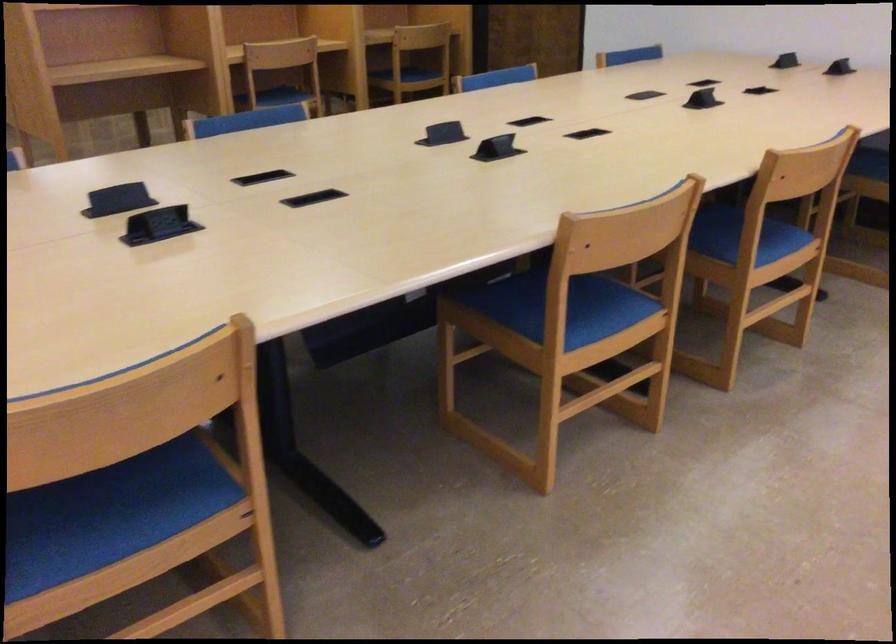
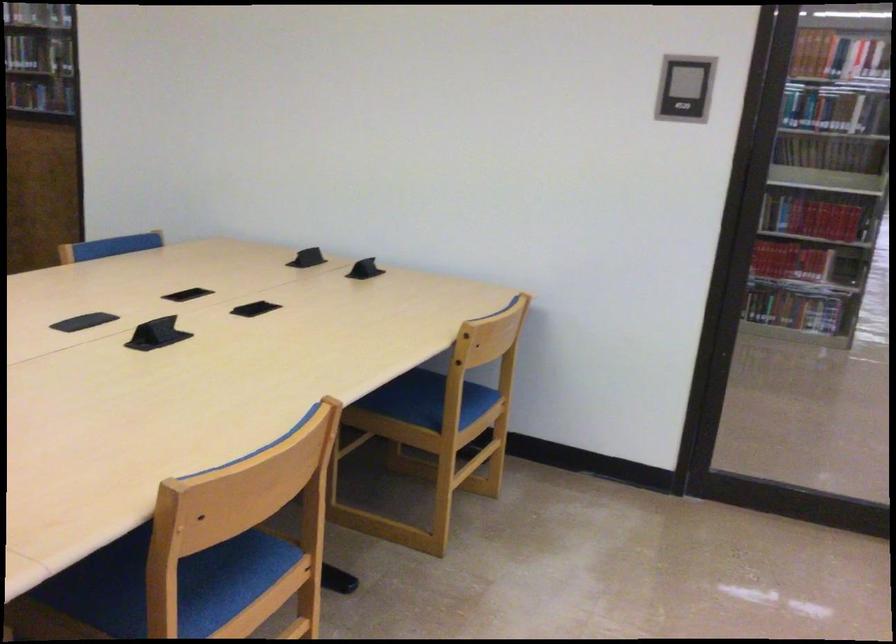
In a continuous first-person perspective shot, in which direction is the camera moving?

The movement direction of the cameraman is right, forward.